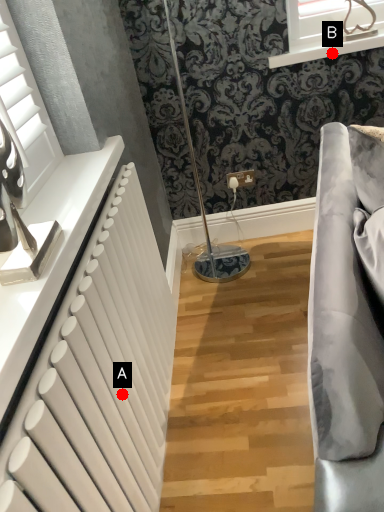
Question: Two points are circled on the image, labeled by A and B beside each circle. Which of the following is the farthest from the observer?

Choices:
 (A) A is further
 (B) B is further

Answer: (B)